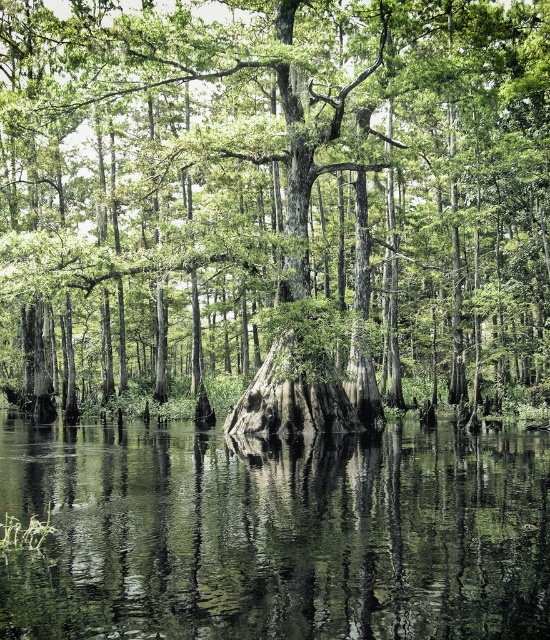
Question: Is smooth bark tree at center bigger than green reflective water at center?

Choices:
 (A) no
 (B) yes

Answer: (B)

Question: Does smooth bark tree at center appear under green reflective water at center?

Choices:
 (A) no
 (B) yes

Answer: (A)

Question: Does smooth bark tree at center appear under green reflective water at center?

Choices:
 (A) yes
 (B) no

Answer: (B)

Question: Which point is farther to the camera?

Choices:
 (A) green reflective water at center
 (B) smooth bark tree at center

Answer: (B)